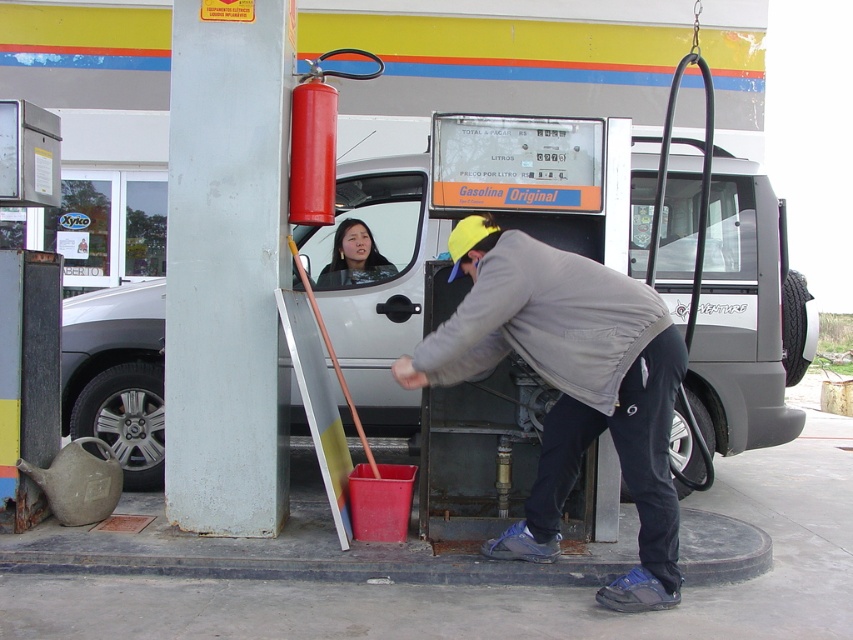
You are a delivery driver who needs to park your 5.5 meter long truck behind the silver metallic van at center. Is there enough space between the van and the building wall to safely park your truck?

The silver metallic van at center and viewer are 6.27 meters apart from each other. Since the truck is 5.5 meters long, there is sufficient space to park safely as 6.27 meters is greater than 5.5 meters.

You are a safety inspector at the gas station and need to ensure that the red matte fire extinguisher at upper left is accessible in case of emergency. Since the matte black jacket at center is blocking part of the extinguisher, does the size of the fire extinguisher matter in determining if it is fully visible and accessible?

The red matte fire extinguisher at upper left is larger in size than the matte black jacket at center, so the jacket cannot fully block the extinguisher. Therefore, the extinguisher remains accessible and visible.

Looking at this image, you are a delivery driver who needs to park your truck near the gas station. There is a silver metallic van at center and a matte black jacket at center in the image. Which object takes up more space in the image?

The silver metallic van at center is bigger than the matte black jacket at center, so the silver metallic van at center takes up more space in the image.